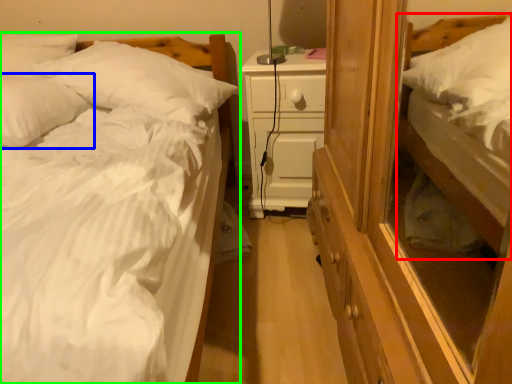
Question: Considering the real-world distances, which object is farthest from bed (highlighted by a red box)? pillow (highlighted by a blue box) or bed (highlighted by a green box)?

Choices:
 (A) pillow
 (B) bed

Answer: (A)